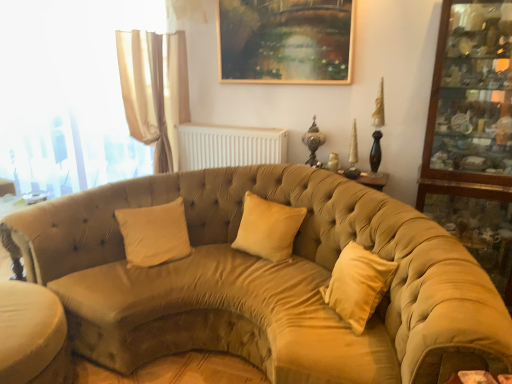
This screenshot has width=512, height=384. Describe the element at coordinates (472, 134) in the screenshot. I see `wooden glass cabinet at right` at that location.

The width and height of the screenshot is (512, 384). In order to click on gold-framed painting at upper center in this screenshot , I will do pyautogui.click(x=285, y=41).

Measure the distance between white plastic radiator at upper center and camera.

9.70 feet.

The width and height of the screenshot is (512, 384). I want to click on suede-like beige pillow at center, acting as the 2th pillow starting from the left, so click(268, 228).

Is suede-like beige pillow at center, the 1th pillow in the right-to-left sequence, taller than beige fabric ottoman at lower left?

No, suede-like beige pillow at center, the 1th pillow in the right-to-left sequence, is not taller than beige fabric ottoman at lower left.

Between suede-like beige pillow at center, acting as the 2th pillow starting from the left, and beige fabric ottoman at lower left, which one is positioned behind?

suede-like beige pillow at center, acting as the 2th pillow starting from the left, is further from the camera.

You are a GUI agent. You are given a task and a screenshot of the screen. Output one action in this format:
    pyautogui.click(x=<x>, y=<y>)
    Task: Click on the 2nd pillow above the beige fabric ottoman at lower left (from the image's perspective)
    
    Given the screenshot: What is the action you would take?
    pyautogui.click(x=268, y=228)

From a real-world perspective, who is located higher, suede-like beige pillow at center, acting as the 2th pillow starting from the left, or beige fabric ottoman at lower left?

suede-like beige pillow at center, acting as the 2th pillow starting from the left, is physically above.

Are suede-like beige pillow at center, the 1th pillow in the right-to-left sequence, and white plastic radiator at upper center far apart?

They are positioned close to each other.

From the picture: Is suede-like beige pillow at center, the 1th pillow in the right-to-left sequence, to the left of white plastic radiator at upper center from the viewer's perspective?

In fact, suede-like beige pillow at center, the 1th pillow in the right-to-left sequence, is to the right of white plastic radiator at upper center.

From their relative heights in the image, would you say suede-like beige pillow at center, the 1th pillow in the right-to-left sequence, is taller or shorter than white plastic radiator at upper center?

suede-like beige pillow at center, the 1th pillow in the right-to-left sequence, is taller than white plastic radiator at upper center.

How many degrees apart are the facing directions of suede-like beige pillow at center, acting as the 2th pillow starting from the left, and white plastic radiator at upper center?

2.42 degrees separate the facing orientations of suede-like beige pillow at center, acting as the 2th pillow starting from the left, and white plastic radiator at upper center.

From the image's perspective, which one is positioned lower, translucent fabric curtain at left or white plastic radiator at upper center?

white plastic radiator at upper center, from the image's perspective.

Based on their sizes in the image, would you say translucent fabric curtain at left is bigger or smaller than white plastic radiator at upper center?

Clearly, translucent fabric curtain at left is larger in size than white plastic radiator at upper center.

From a real-world perspective, is translucent fabric curtain at left on top of white plastic radiator at upper center?

Correct, in the physical world, translucent fabric curtain at left is higher than white plastic radiator at upper center.

Is translucent fabric curtain at left positioned beyond the bounds of white plastic radiator at upper center?

Yes.

From a real-world perspective, which object stands above the other?

suede-like beige pillow at center, the 1th pillow in the right-to-left sequence, is physically above.

Is suede-like beige pillow at center, acting as the 2th pillow starting from the left, at the back of velvet beige couch at center?

Yes, velvet beige couch at center's orientation is away from suede-like beige pillow at center, acting as the 2th pillow starting from the left.

Is velvet beige couch at center positioned in front of suede-like beige pillow at center, acting as the 2th pillow starting from the left?

Yes.

From the picture: How many degrees apart are the facing directions of velvet beige couch at center and suede-like beige pillow at center, the 1th pillow in the right-to-left sequence?

2.19 degrees separate the facing orientations of velvet beige couch at center and suede-like beige pillow at center, the 1th pillow in the right-to-left sequence.

From the image's perspective, is beige fabric ottoman at lower left located beneath beige velvet pillow at center, which is the 2th pillow from right to left?

Correct, beige fabric ottoman at lower left appears lower than beige velvet pillow at center, which is the 2th pillow from right to left, in the image.

Can you confirm if beige fabric ottoman at lower left is positioned to the left of beige velvet pillow at center, the first pillow in the left-to-right sequence?

Yes, beige fabric ottoman at lower left is to the left of beige velvet pillow at center, the first pillow in the left-to-right sequence.

From a real-world perspective, is beige fabric ottoman at lower left under beige velvet pillow at center, the first pillow in the left-to-right sequence?

Indeed, from a real-world perspective, beige fabric ottoman at lower left is positioned beneath beige velvet pillow at center, the first pillow in the left-to-right sequence.

Considering the sizes of objects beige fabric ottoman at lower left and beige velvet pillow at center, which is the 2th pillow from right to left, in the image provided, who is wider, beige fabric ottoman at lower left or beige velvet pillow at center, which is the 2th pillow from right to left,?

→ beige fabric ottoman at lower left.

Does white plastic radiator at upper center have a greater width compared to beige fabric ottoman at lower left?

In fact, white plastic radiator at upper center might be narrower than beige fabric ottoman at lower left.

From a real-world perspective, is white plastic radiator at upper center over beige fabric ottoman at lower left?

Correct, in the physical world, white plastic radiator at upper center is higher than beige fabric ottoman at lower left.

From the image's perspective, is white plastic radiator at upper center positioned above or below beige fabric ottoman at lower left?

Clearly, from the image's perspective, white plastic radiator at upper center is above beige fabric ottoman at lower left.

Is point (203, 126) closer or farther from the camera than point (29, 326)?

Point (203, 126).

Is beige velvet pillow at center, the first pillow in the left-to-right sequence, at the back of wooden glass cabinet at right?

No, wooden glass cabinet at right is not facing away from beige velvet pillow at center, the first pillow in the left-to-right sequence.

Which of these two, wooden glass cabinet at right or beige velvet pillow at center, which is the 2th pillow from right to left, is smaller?

beige velvet pillow at center, which is the 2th pillow from right to left.

Which is closer, (497, 110) or (125, 216)?

The point (497, 110) is more forward.

You are a GUI agent. You are given a task and a screenshot of the screen. Output one action in this format:
    pyautogui.click(x=<x>, y=<y>)
    Task: Click on the armoire in front of the beige velvet pillow at center, the first pillow in the left-to-right sequence
    
    Given the screenshot: What is the action you would take?
    pyautogui.click(x=472, y=134)

From the image's perspective, count 2nd pillows upward from the beige fabric ottoman at lower left and point to it. Please provide its 2D coordinates.

[(268, 228)]

The image size is (512, 384). What are the coordinates of `radiator that is on the left side of suede-like beige pillow at center, the 1th pillow in the right-to-left sequence` in the screenshot? It's located at (229, 146).

Looking at the image, which one is located further to wooden glass cabinet at right, beige velvet pillow at center, which is the 2th pillow from right to left, or translucent fabric curtain at left?

translucent fabric curtain at left.

Estimate the real-world distances between objects in this image. Which object is further from suede-like beige pillow at center, the 1th pillow in the right-to-left sequence, beige fabric ottoman at lower left or gold-framed painting at upper center?

beige fabric ottoman at lower left.

Considering their positions, is gold-framed painting at upper center positioned further to suede-like beige pillow at center, acting as the 2th pillow starting from the left, than velvet beige couch at center?

The object further to suede-like beige pillow at center, acting as the 2th pillow starting from the left, is gold-framed painting at upper center.

When comparing their distances from beige fabric ottoman at lower left, does white plastic radiator at upper center or gold-framed painting at upper center seem further?

The object further to beige fabric ottoman at lower left is gold-framed painting at upper center.

Based on their spatial positions, is white plastic radiator at upper center or suede-like beige pillow at center, acting as the 2th pillow starting from the left, further from beige fabric ottoman at lower left?

white plastic radiator at upper center.

When comparing their distances from white plastic radiator at upper center, does beige fabric ottoman at lower left or beige velvet pillow at center, which is the 2th pillow from right to left, seem closer?

Based on the image, beige velvet pillow at center, which is the 2th pillow from right to left, appears to be nearer to white plastic radiator at upper center.

When comparing their distances from beige velvet pillow at center, the first pillow in the left-to-right sequence, does translucent fabric curtain at left or gold-framed painting at upper center seem closer?

Based on the image, gold-framed painting at upper center appears to be nearer to beige velvet pillow at center, the first pillow in the left-to-right sequence.

Considering their positions, is beige velvet pillow at center, which is the 2th pillow from right to left, positioned closer to suede-like beige pillow at center, the 1th pillow in the right-to-left sequence, than beige fabric ottoman at lower left?

Based on the image, beige velvet pillow at center, which is the 2th pillow from right to left, appears to be nearer to suede-like beige pillow at center, the 1th pillow in the right-to-left sequence.

Locate an element on the screen. radiator located between translucent fabric curtain at left and gold-framed painting at upper center in the left-right direction is located at coordinates (229, 146).

Locate an element on the screen. This screenshot has width=512, height=384. footrest between translucent fabric curtain at left and white plastic radiator at upper center is located at coordinates (32, 335).

The height and width of the screenshot is (384, 512). I want to click on footrest between velvet beige couch at center and white plastic radiator at upper center along the z-axis, so click(x=32, y=335).

The image size is (512, 384). What are the coordinates of `radiator between gold-framed painting at upper center and beige velvet pillow at center, the first pillow in the left-to-right sequence, from top to bottom` in the screenshot? It's located at point(229,146).